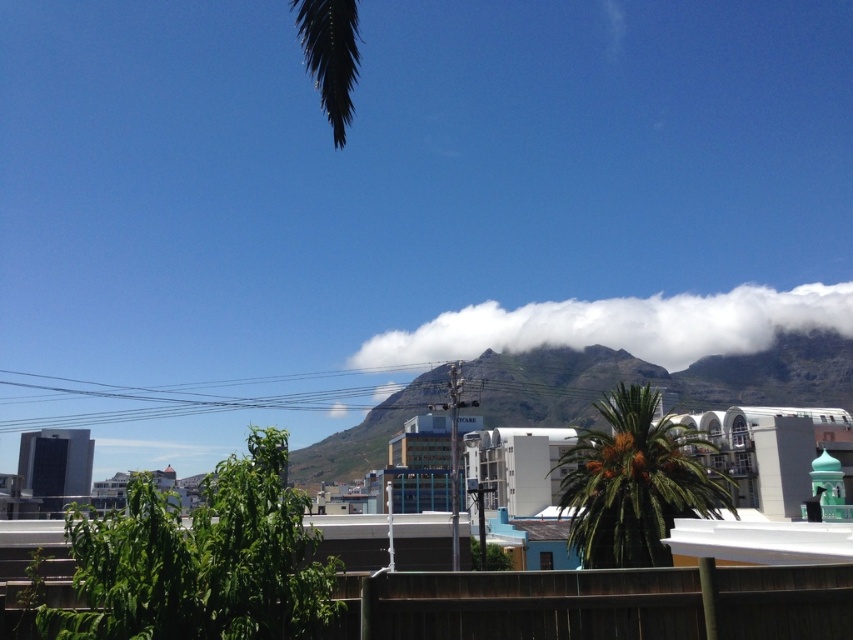
Question: Is white fluffy cloud at center to the left of green leafy palm tree at center from the viewer's perspective?

Choices:
 (A) yes
 (B) no

Answer: (B)

Question: Does white fluffy cloud at center appear over green leafy palm tree at center?

Choices:
 (A) no
 (B) yes

Answer: (B)

Question: Can you confirm if white fluffy cloud at center is smaller than green leafy palm tree at center?

Choices:
 (A) yes
 (B) no

Answer: (B)

Question: Among these objects, which one is farthest from the camera?

Choices:
 (A) white fluffy cloud at center
 (B) green leafy palm tree at center

Answer: (A)